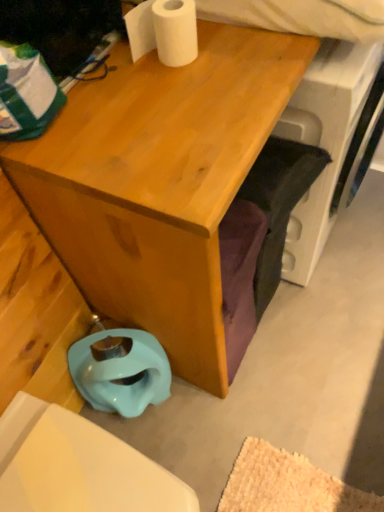
The height and width of the screenshot is (512, 384). I want to click on free space to the left of white matte toilet paper at upper center, so click(105, 80).